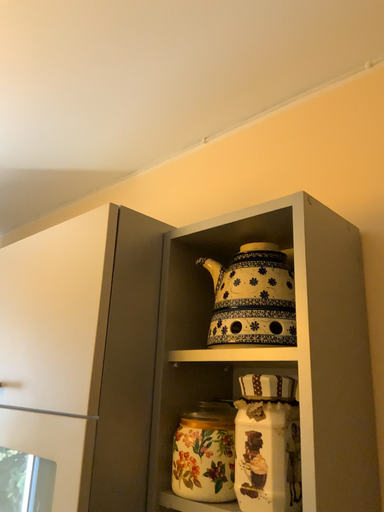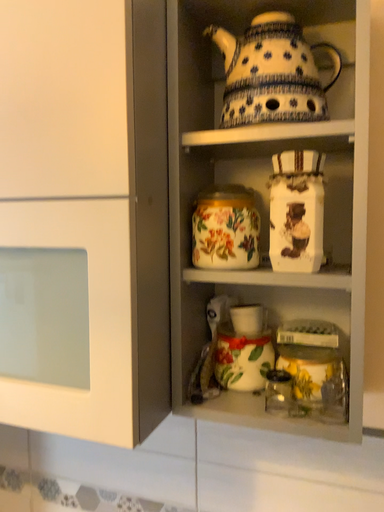
Question: How did the camera likely rotate when shooting the video?

Choices:
 (A) rotated left
 (B) rotated right

Answer: (B)